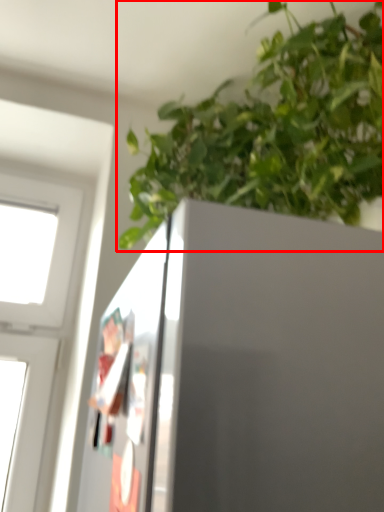
Question: In this image, where is houseplant (annotated by the red box) located relative to screen door?

Choices:
 (A) left
 (B) right

Answer: (B)